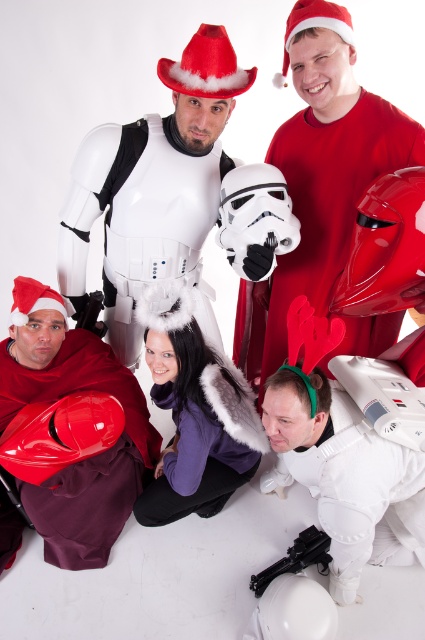
The image size is (425, 640). What do you see at coordinates (206, 67) in the screenshot?
I see `red velvet santa hat at upper center` at bounding box center [206, 67].

Is red velvet santa hat at upper center above black plastic gun at lower center?

Yes, red velvet santa hat at upper center is above black plastic gun at lower center.

The image size is (425, 640). What do you see at coordinates (206, 67) in the screenshot?
I see `red velvet santa hat at upper center` at bounding box center [206, 67].

I want to click on red velvet santa hat at upper center, so click(x=206, y=67).

Is white matte stormtrooper armor at center below matte black gun at lower left?

No.

Can you confirm if white matte stormtrooper armor at center is thinner than matte black gun at lower left?

No, white matte stormtrooper armor at center is not thinner than matte black gun at lower left.

The image size is (425, 640). What do you see at coordinates (139, 220) in the screenshot?
I see `white matte stormtrooper armor at center` at bounding box center [139, 220].

I want to click on white matte stormtrooper armor at center, so click(139, 220).

Is white matte helmet at lower center below matte black gun at lower left?

Indeed, white matte helmet at lower center is positioned under matte black gun at lower left.

In the scene shown: Can you confirm if white matte helmet at lower center is positioned above matte black gun at lower left?

No, white matte helmet at lower center is not above matte black gun at lower left.

Between point (331, 388) and point (96, 304), which one is positioned behind?

Positioned behind is point (96, 304).

This screenshot has height=640, width=425. In order to click on white matte helmet at lower center in this screenshot , I will do `click(340, 472)`.